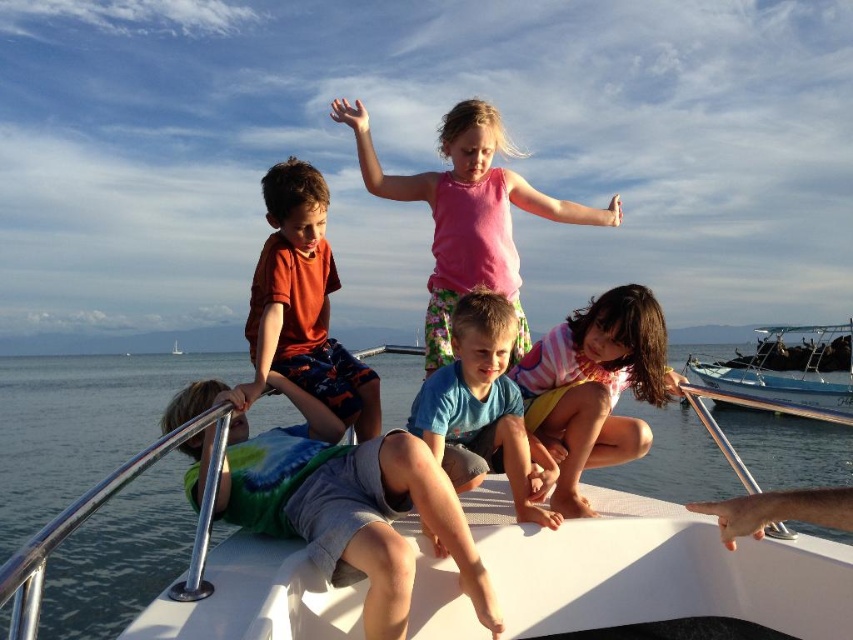
Where is the matte orange shirt at upper left located in the image?

The matte orange shirt at upper left is located at point (303, 304).